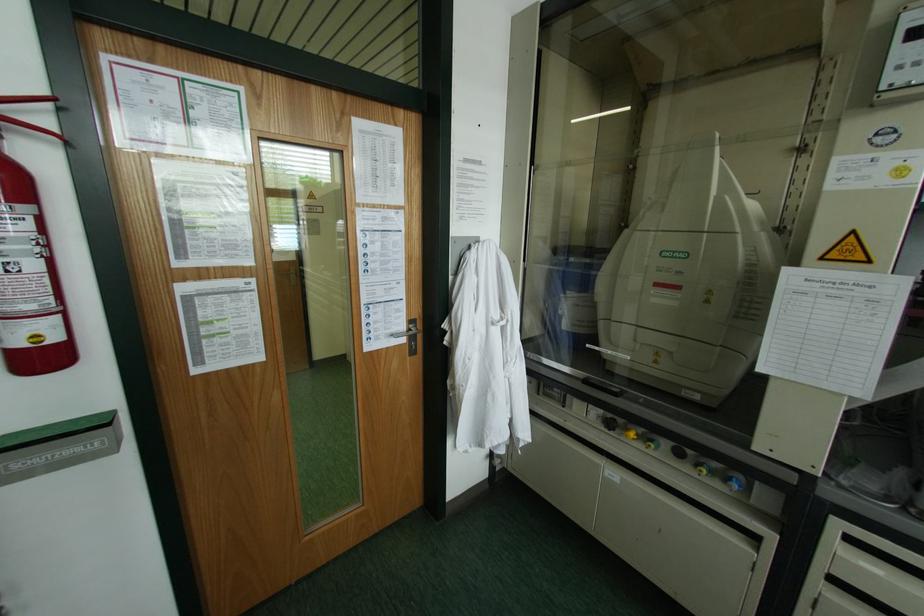
This screenshot has height=616, width=924. In order to click on yellow control knob in this screenshot , I will do `click(629, 432)`.